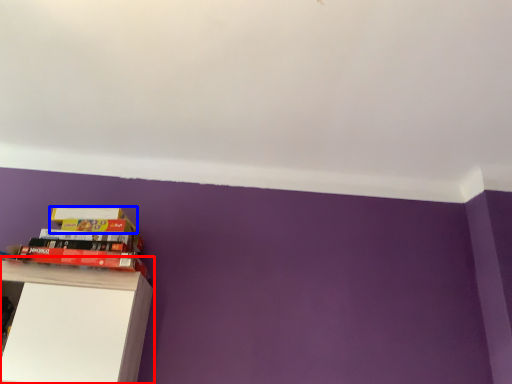
Question: Which point is closer to the camera, shelf (highlighted by a red box) or paperback book (highlighted by a blue box)?

Choices:
 (A) shelf
 (B) paperback book

Answer: (A)